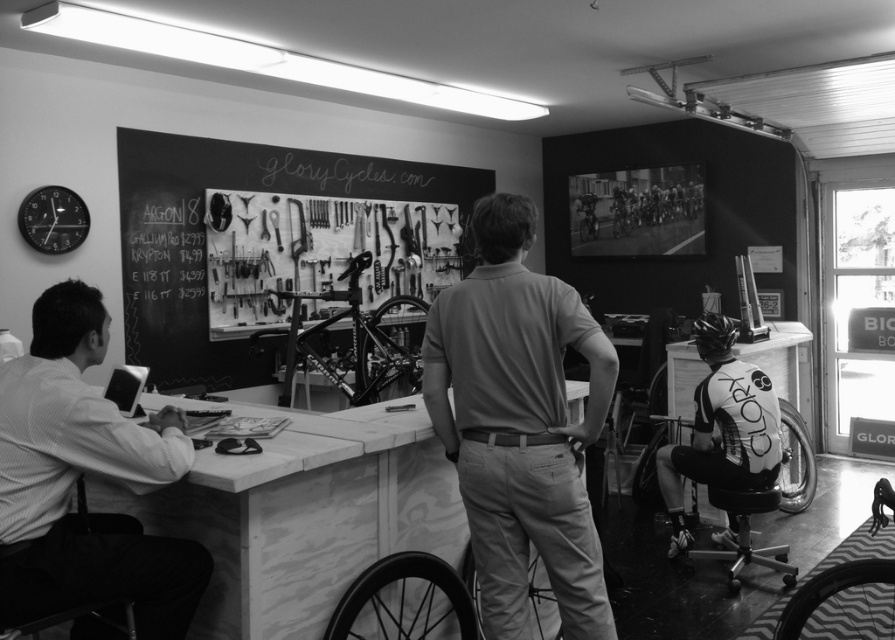
You are a customer in the GloryCycles.com bicycle shop and want to see the pricing information for the Argon 8 bike. The pricing information is on the chalkboard behind the counter. You are currently standing at point (518, 424), which is where the smooth beige polo shirt at center is located. To reach the chalkboard, you need to walk around the counter. Is there enough space between the counter and the chalkboard for you to walk through comfortably? The counter has a width of 1.2 meters and the distance

The smooth beige polo shirt at center is located at point (518, 424). Since the counter has a width of 1.2 meters, there should be sufficient space between the counter and the chalkboard to walk through comfortably.

You are a customer entering the GloryCycles.com shop and notice the smooth beige polo shirt at center and the chalkboard with tools at center behind the counter. Which object takes up more space in the scene?

The chalkboard with tools at center takes up more space in the scene because the smooth beige polo shirt at center occupies less space than the chalkboard with tools at center.

You are standing at the entrance of the GloryCycles.com bicycle shop and see two points marked in the scene. The first point is at coordinates point (66, 522) and the second is at point (744, 369). Which point is closer to you?

Point (66, 522) is closer to the viewer than point (744, 369).